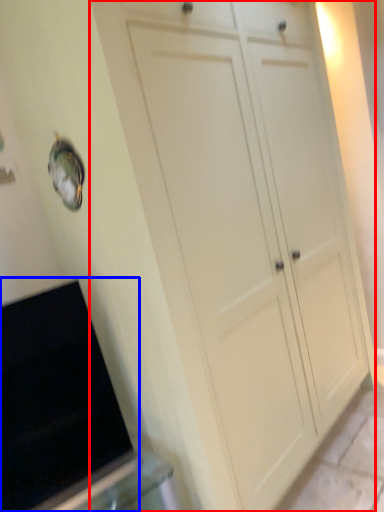
Question: Which object appears closest to the camera in this image, cupboard (highlighted by a red box) or appliance (highlighted by a blue box)?

Choices:
 (A) cupboard
 (B) appliance

Answer: (A)